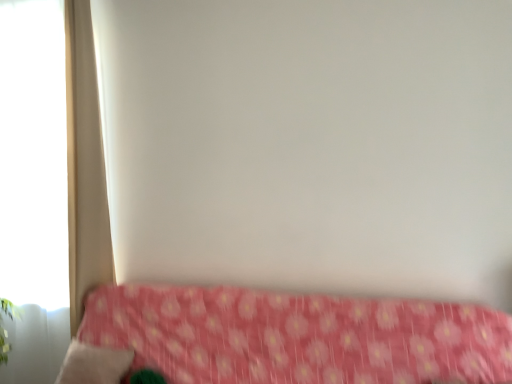
Question: From a real-world perspective, is white fabric curtain at left over beige fabric pillow at lower left?

Choices:
 (A) no
 (B) yes

Answer: (B)

Question: From the image's perspective, does white fabric curtain at left appear lower than beige fabric pillow at lower left?

Choices:
 (A) no
 (B) yes

Answer: (A)

Question: Does white fabric curtain at left have a lesser width compared to beige fabric pillow at lower left?

Choices:
 (A) yes
 (B) no

Answer: (A)

Question: Is white fabric curtain at left at the left side of beige fabric pillow at lower left?

Choices:
 (A) yes
 (B) no

Answer: (A)

Question: Can you confirm if white fabric curtain at left is positioned to the right of beige fabric pillow at lower left?

Choices:
 (A) no
 (B) yes

Answer: (A)

Question: Does point (104, 362) appear closer or farther from the camera than point (53, 268)?

Choices:
 (A) closer
 (B) farther

Answer: (A)

Question: Is beige fabric pillow at lower left situated inside white matte window at left or outside?

Choices:
 (A) inside
 (B) outside

Answer: (B)

Question: Is beige fabric pillow at lower left in front of or behind white matte window at left in the image?

Choices:
 (A) behind
 (B) front

Answer: (B)

Question: In the image, is beige fabric pillow at lower left on the left side or the right side of white matte window at left?

Choices:
 (A) right
 (B) left

Answer: (A)

Question: Is beige fabric pillow at lower left bigger or smaller than white fabric curtain at left?

Choices:
 (A) small
 (B) big

Answer: (A)

Question: Considering the positions of point pyautogui.click(x=76, y=339) and point pyautogui.click(x=75, y=228), is point pyautogui.click(x=76, y=339) closer or farther from the camera than point pyautogui.click(x=75, y=228)?

Choices:
 (A) farther
 (B) closer

Answer: (B)

Question: Looking at their shapes, would you say beige fabric pillow at lower left is wider or thinner than white fabric curtain at left?

Choices:
 (A) thin
 (B) wide

Answer: (B)

Question: Considering the relative positions of beige fabric pillow at lower left and white fabric curtain at left in the image provided, is beige fabric pillow at lower left to the left or to the right of white fabric curtain at left?

Choices:
 (A) left
 (B) right

Answer: (B)

Question: From a real-world perspective, is beige fabric pillow at lower left above or below pink floral fabric at lower center?

Choices:
 (A) below
 (B) above

Answer: (A)

Question: Is beige fabric pillow at lower left bigger or smaller than pink floral fabric at lower center?

Choices:
 (A) big
 (B) small

Answer: (B)